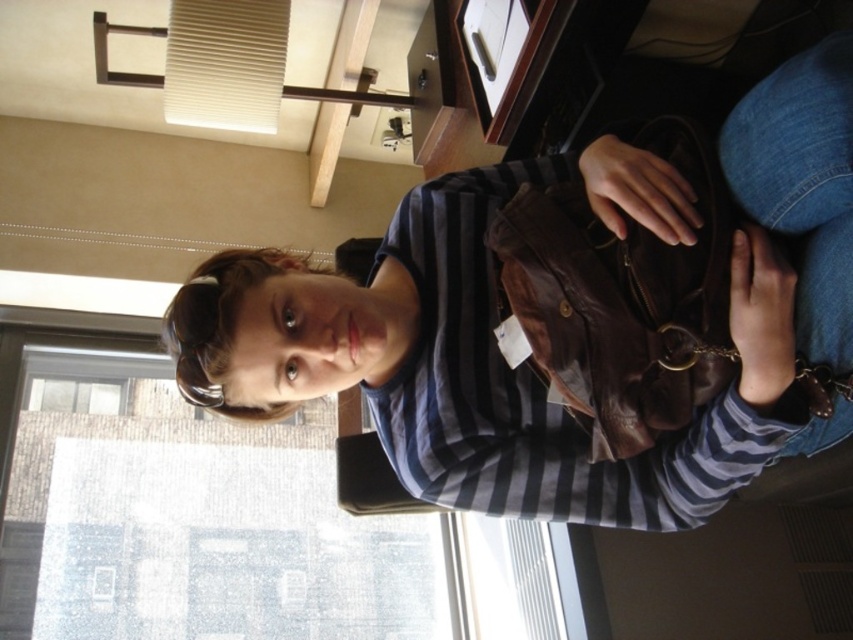
Does matte brown purse at center appear on the left side of transparent glass window at upper left?

No, matte brown purse at center is not to the left of transparent glass window at upper left.

What do you see at coordinates (525, 364) in the screenshot? The width and height of the screenshot is (853, 640). I see `matte brown purse at center` at bounding box center [525, 364].

Identify the location of matte brown purse at center. (525, 364).